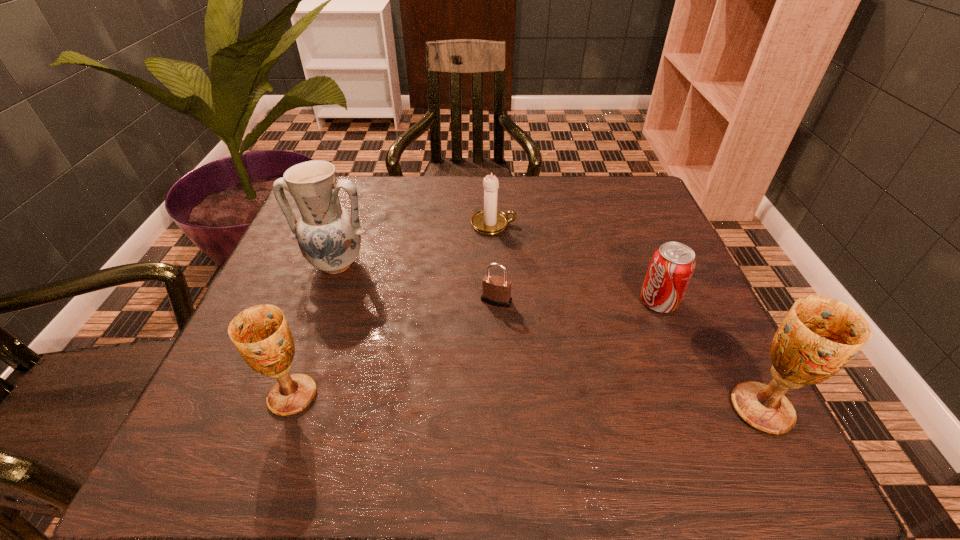
Locate an element on the screen. The image size is (960, 540). free spot that satisfies the following two spatial constraints: 1. on the handle side of the farthest object; 2. on the front side of the fourth shortest object is located at coordinates (500, 396).

This screenshot has height=540, width=960. Find the location of `blank space that satisfies the following two spatial constraints: 1. on the handle side of the padlock; 2. on the right side of the farthest object`. blank space that satisfies the following two spatial constraints: 1. on the handle side of the padlock; 2. on the right side of the farthest object is located at coordinates (496, 301).

This screenshot has height=540, width=960. I want to click on vacant space that satisfies the following two spatial constraints: 1. on the back side of the rightmost object; 2. on the handle side of the farthest object, so coord(666,224).

Image resolution: width=960 pixels, height=540 pixels. In order to click on vacant position in the image that satisfies the following two spatial constraints: 1. on the handle side of the farthest object; 2. on the right side of the taller chalice in this screenshot , I will do `click(500, 409)`.

Image resolution: width=960 pixels, height=540 pixels. Identify the location of free space that satisfies the following two spatial constraints: 1. on either side of the taller chalice; 2. on the left side of the fifth nearest object. (284, 409).

In order to click on vacant region that satisfies the following two spatial constraints: 1. on the back side of the third tallest object; 2. on the right side of the shortest object in this screenshot , I will do `click(326, 301)`.